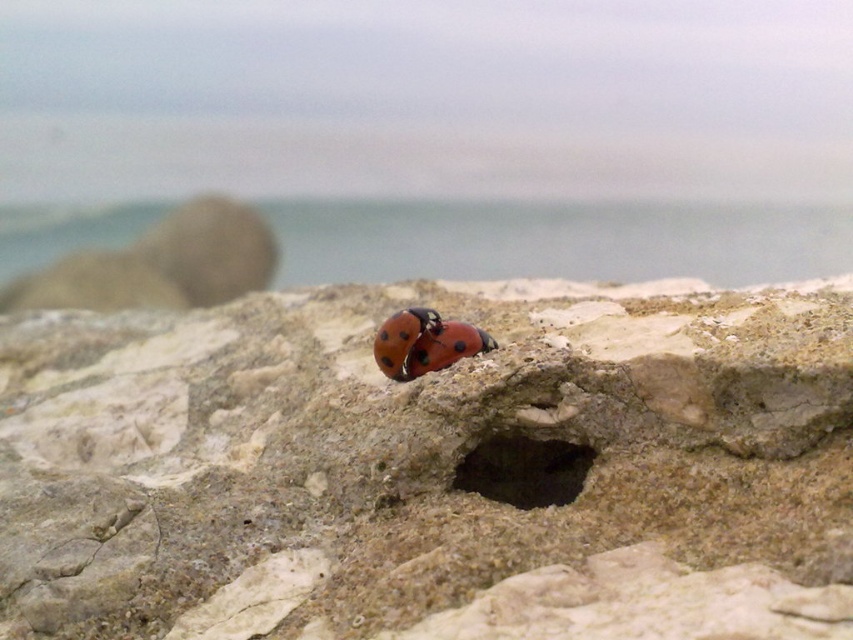
You are a photographer trying to focus on two points in the image. The first point is at point (51, 509) and the second is at point (486, 492). Which point will appear larger in your photo?

Point (51, 509) is closer to the camera than point (486, 492), so it will appear larger in the photo.

You are an entomologist examining two insects on a rock. You have a magnifying glass with a 3cm focal length. The smooth stone ladybug at center and the shiny red beetle at center are both in your view. Which insect will appear larger when viewed through the magnifying glass?

The smooth stone ladybug at center will appear larger when viewed through the magnifying glass because it has a greater height compared to the shiny red beetle at center.

You are a scientist observing the ladybugs on the rock. You notice a dark stone hole at center and a shiny red beetle at center. Which object is located below the other?

The dark stone hole at center is positioned under the shiny red beetle at center, so the hole is below the beetle.